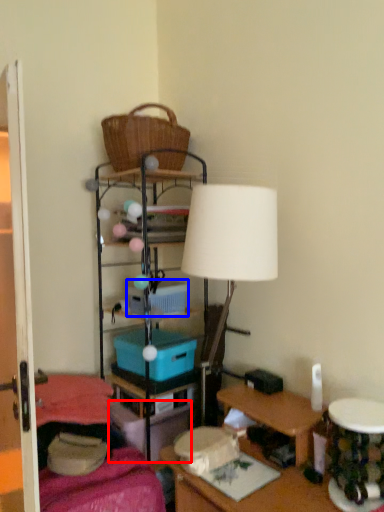
Question: Among these objects, which one is farthest to the camera, storage box (highlighted by a red box) or storage box (highlighted by a blue box)?

Choices:
 (A) storage box
 (B) storage box

Answer: (B)